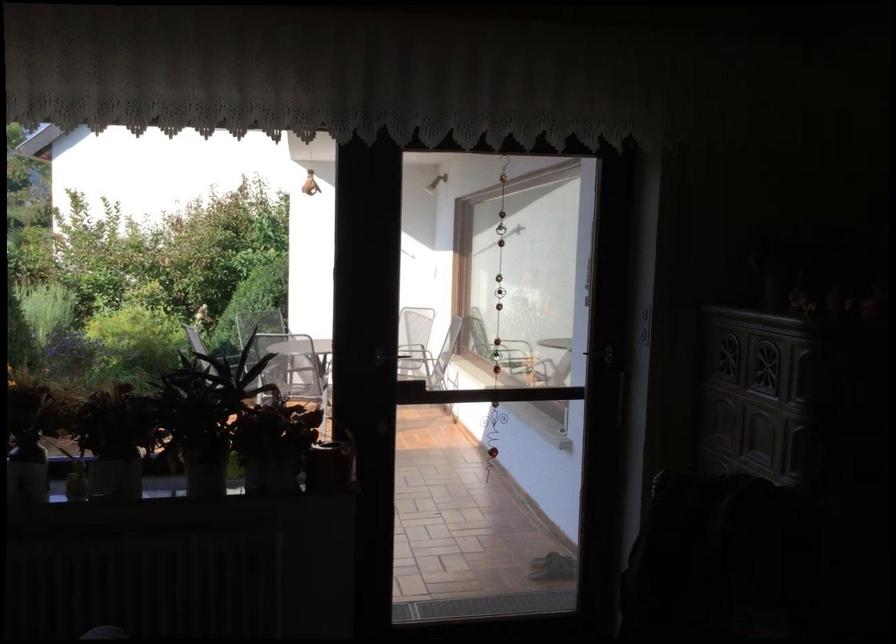
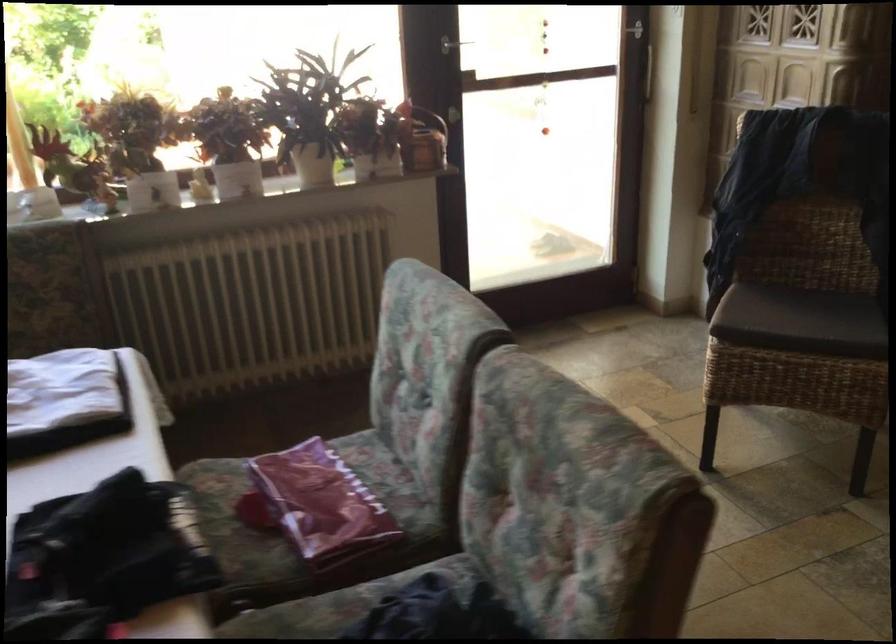
Question: How did the camera likely rotate?

Choices:
 (A) Left
 (B) Right
 (C) Up
 (D) Down

Answer: (D)